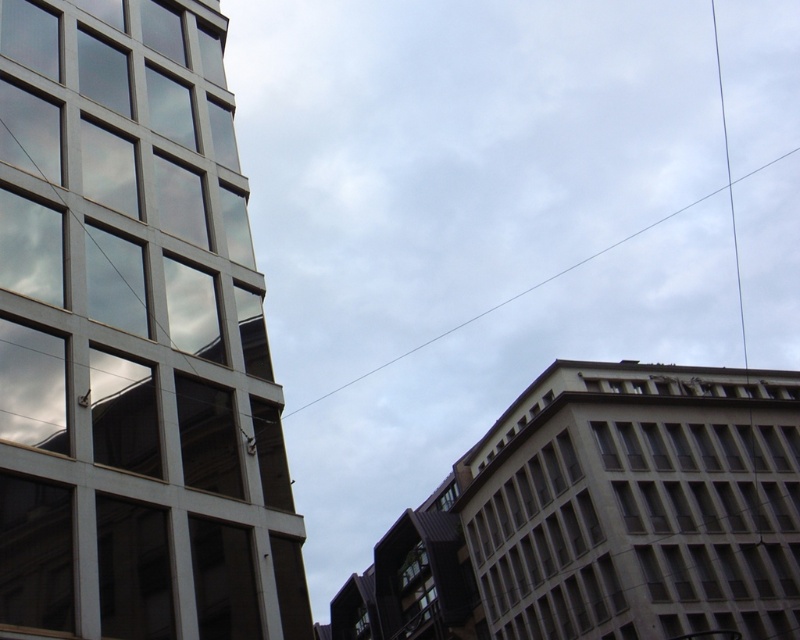
You are a city planner reviewing this urban layout. You notice the beige concrete building at right and the white wire at upper center. Which object is located higher in the image?

The white wire at upper center is higher because it is positioned above the beige concrete building at right.

You are a drone operator trying to deliver a package to the beige concrete building at right. Your GPS shows a delivery point at coordinates point [638,504]. Based on the scene, can you confirm if this point is on the beige concrete building at right?

Yes, the point [638,504] is on the beige concrete building at right as stated in the description.